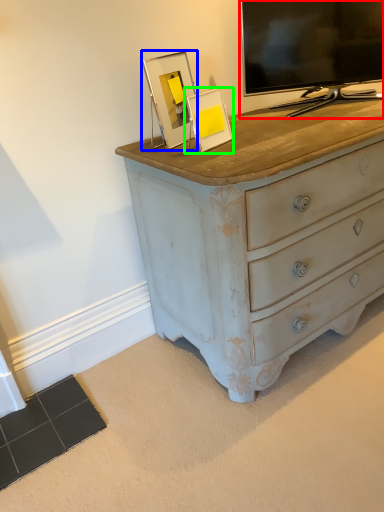
Question: Based on their relative distances, which object is nearer to television (highlighted by a red box)? Choose from picture frame (highlighted by a blue box) and picture frame (highlighted by a green box).

Choices:
 (A) picture frame
 (B) picture frame

Answer: (B)